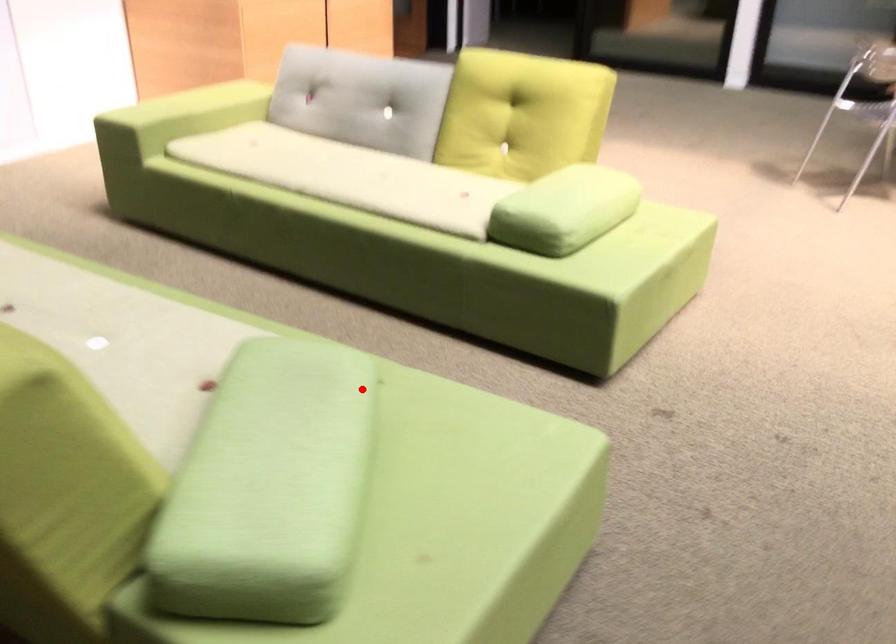
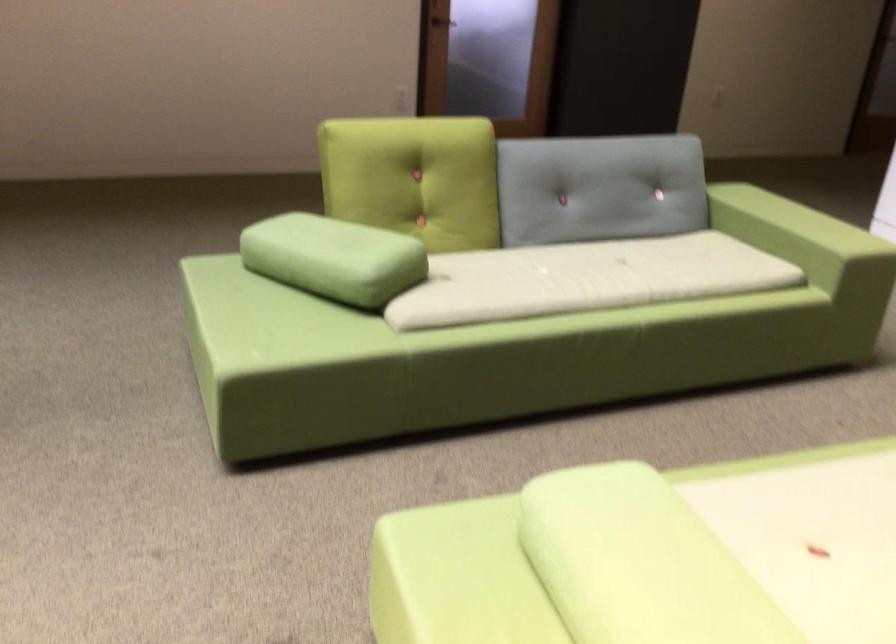
Question: I am providing you with two images of the same scene from different viewpoints. A red point is shown in image1. For the corresponding object point in image2, is it positioned nearer or farther from the camera?

Choices:
 (A) Nearer
 (B) Farther

Answer: (B)